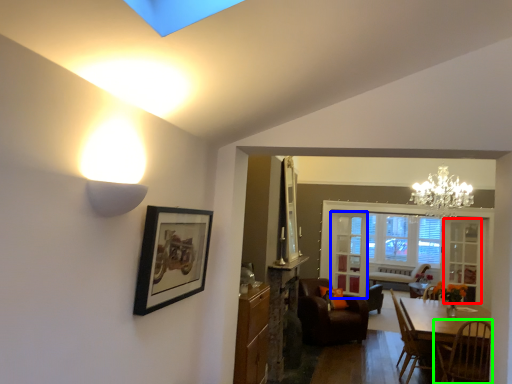
Question: Which object is the farthest from glass door (highlighted by a red box)? Choose among these: glass door (highlighted by a blue box) or chair (highlighted by a green box).

Choices:
 (A) glass door
 (B) chair

Answer: (B)